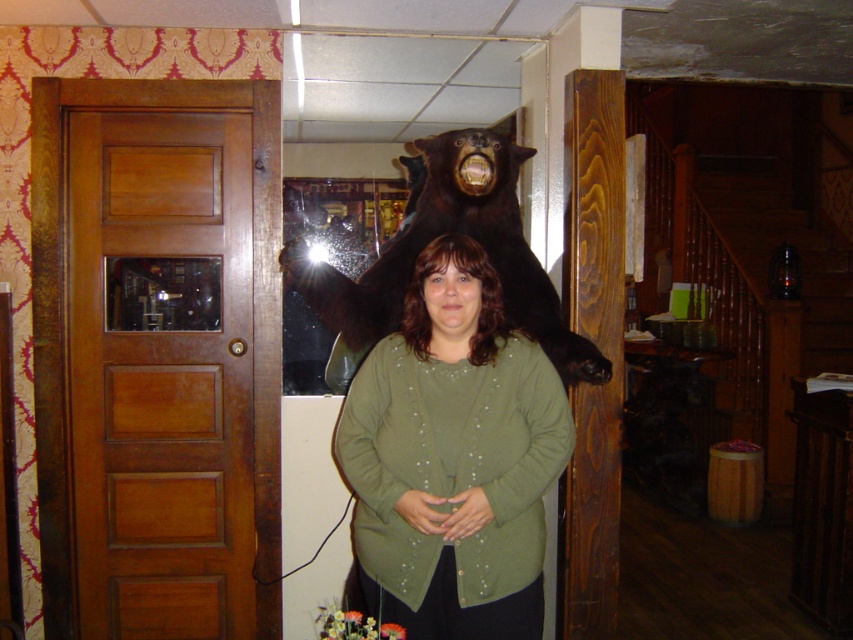
Which is more to the right, olive green sweater at center or matte green shirt at center?

From the viewer's perspective, matte green shirt at center appears more on the right side.

Between point (384, 461) and point (405, 292), which one is positioned behind?

Positioned behind is point (405, 292).

Between point (471, 502) and point (444, 268), which one is positioned in front?

Positioned in front is point (471, 502).

This screenshot has height=640, width=853. What are the coordinates of `olive green sweater at center` in the screenshot? It's located at (453, 458).

Which is above, shiny brown bear at upper center or matte green shirt at center?

shiny brown bear at upper center

Does shiny brown bear at upper center have a lesser height compared to matte green shirt at center?

No.

Does point (329, 320) come farther from viewer compared to point (437, 248)?

Yes.

The width and height of the screenshot is (853, 640). Find the location of `shiny brown bear at upper center`. shiny brown bear at upper center is located at coordinates (445, 232).

Does olive green sweater at center have a lesser width compared to shiny brown bear at upper center?

Indeed, olive green sweater at center has a lesser width compared to shiny brown bear at upper center.

The width and height of the screenshot is (853, 640). What are the coordinates of `olive green sweater at center` in the screenshot? It's located at (453, 458).

This screenshot has height=640, width=853. Find the location of `olive green sweater at center`. olive green sweater at center is located at coordinates (453, 458).